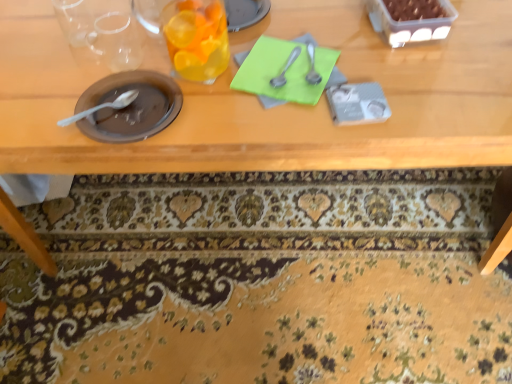
Find the location of a particular element. The height and width of the screenshot is (384, 512). vacant space situated on the left part of satin silver spoon at center, positioned as the third tableware in left-to-right order is located at coordinates (213, 83).